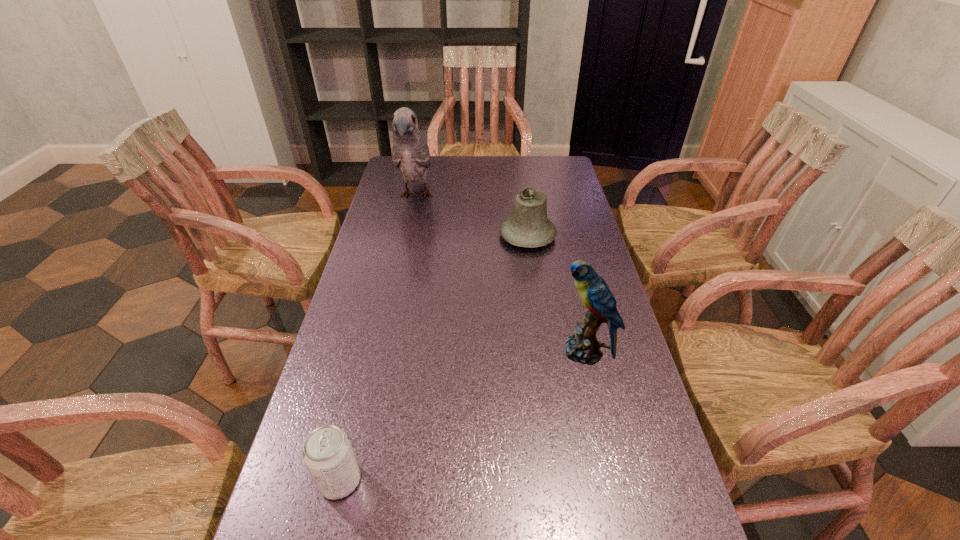
Where is `free space at the far edge`? free space at the far edge is located at coordinates (468, 174).

Locate an element on the screen. The height and width of the screenshot is (540, 960). vacant region at the left edge of the desktop is located at coordinates (388, 193).

You are a GUI agent. You are given a task and a screenshot of the screen. Output one action in this format:
    pyautogui.click(x=<x>, y=<y>)
    Task: Click on the free location at the right edge
    
    Given the screenshot: What is the action you would take?
    point(561,219)

This screenshot has height=540, width=960. Find the location of `vacant space at the far right corner`. vacant space at the far right corner is located at coordinates (531, 168).

You are a GUI agent. You are given a task and a screenshot of the screen. Output one action in this format:
    pyautogui.click(x=<x>, y=<y>)
    Task: Click on the unoccupied area between the tallest object and the shorter parrot
    This screenshot has height=540, width=960.
    Given the screenshot: What is the action you would take?
    pyautogui.click(x=500, y=274)

This screenshot has height=540, width=960. What are the coordinates of `free point between the taller parrot and the shortest object` in the screenshot? It's located at (378, 338).

In order to click on vacant space that's between the taller parrot and the nearest object in this screenshot , I will do `click(378, 338)`.

You are a GUI agent. You are given a task and a screenshot of the screen. Output one action in this format:
    pyautogui.click(x=<x>, y=<y>)
    Task: Click on the free space between the farthest object and the nearer parrot
    The width and height of the screenshot is (960, 540).
    Given the screenshot: What is the action you would take?
    pyautogui.click(x=500, y=274)

Identify the location of vacant region between the left parrot and the soda can. Image resolution: width=960 pixels, height=540 pixels. (378, 338).

Where is `free point between the taller parrot and the bell`? This screenshot has height=540, width=960. free point between the taller parrot and the bell is located at coordinates (471, 216).